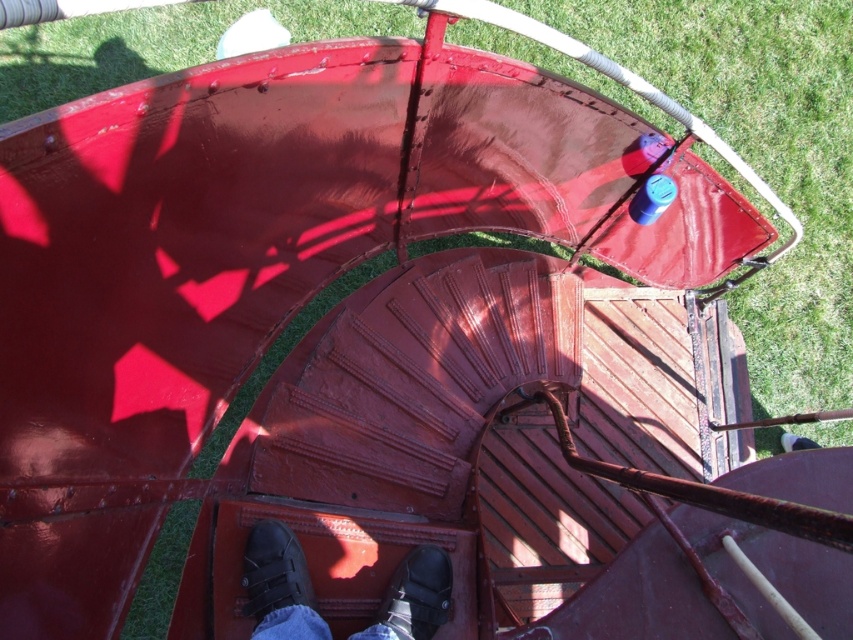
You are standing at the bottom of the spiral staircase and want to place your black leather shoe at center on the rusty metal stairs at center. Considering their sizes, will the shoe fit entirely on the step?

The rusty metal stairs at center has a larger size compared to black leather shoe at center, so the shoe will fit entirely on the step.

You are standing at the bottom of the spiral staircase and notice two black leather shoes in your view. Which shoe is closer to you, the black leather shoe at center or the black leather shoe at lower center?

The black leather shoe at lower center is closer to you because it is positioned below the black leather shoe at center, which is further away.

You are standing at the bottom of the spiral staircase and want to place your black leather shoe at lower center on the first step of the rusty metal stairs at center. Based on their widths, will the shoe fit entirely on the step?

The rusty metal stairs at center might be wider than black leather shoe at lower center, so there is a possibility that the shoe will fit entirely on the step. However, since the width comparison is uncertain, it is recommended to check the actual dimensions before placing the shoe.